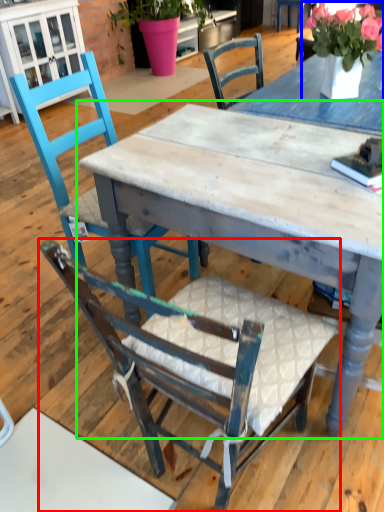
Question: Based on their relative distances, which object is nearer to chair (highlighted by a red box)? Choose from floral arrangement (highlighted by a blue box) and table (highlighted by a green box).

Choices:
 (A) floral arrangement
 (B) table

Answer: (B)